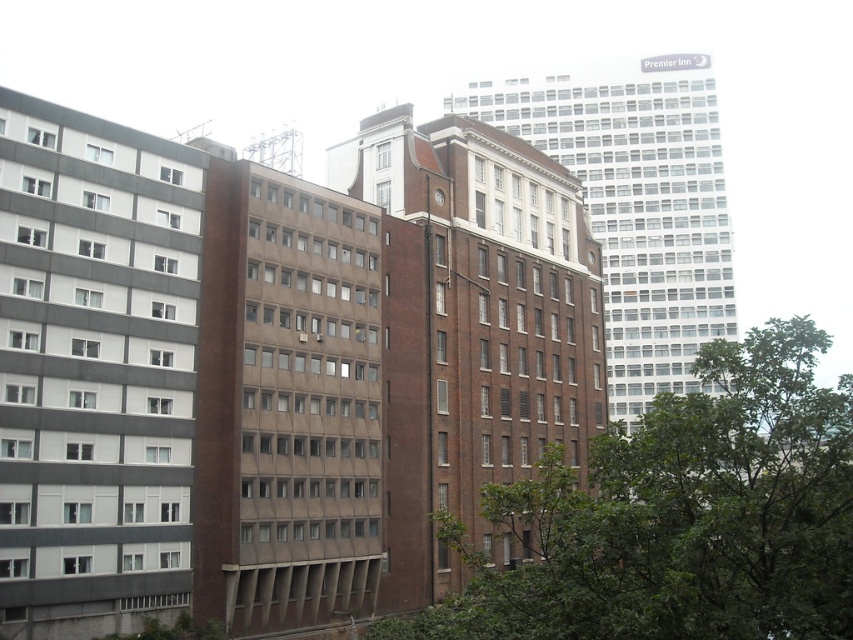
Is green leafy tree at center shorter than brown brick building at center?

Yes.

Is point (821, 429) in front of point (726, 275)?

Yes, point (821, 429) is in front of point (726, 275).

Image resolution: width=853 pixels, height=640 pixels. I want to click on green leafy tree at center, so click(x=677, y=516).

Is green leafy tree at center bigger than metallic clock at center?

Indeed, green leafy tree at center has a larger size compared to metallic clock at center.

Can you confirm if green leafy tree at center is positioned to the left of metallic clock at center?

Incorrect, green leafy tree at center is not on the left side of metallic clock at center.

Who is more distant from viewer, (738, 474) or (444, 200)?

The point (444, 200) is more distant.

You are a GUI agent. You are given a task and a screenshot of the screen. Output one action in this format:
    pyautogui.click(x=<x>, y=<y>)
    Task: Click on the green leafy tree at center
    The height and width of the screenshot is (640, 853).
    Given the screenshot: What is the action you would take?
    pyautogui.click(x=677, y=516)

Looking at this image, does brown brick building at center have a lesser width compared to metallic clock at center?

No, brown brick building at center is not thinner than metallic clock at center.

Is brown brick building at center to the right of metallic clock at center from the viewer's perspective?

Correct, you'll find brown brick building at center to the right of metallic clock at center.

What do you see at coordinates (636, 202) in the screenshot? I see `brown brick building at center` at bounding box center [636, 202].

Where is `brown brick building at center`? The width and height of the screenshot is (853, 640). brown brick building at center is located at coordinates (636, 202).